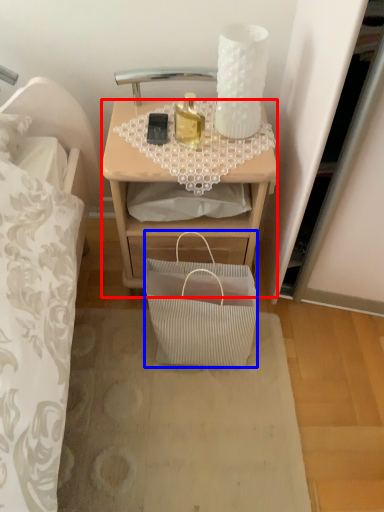
Question: Which object appears farthest to the camera in this image, desk (highlighted by a red box) or handbag (highlighted by a blue box)?

Choices:
 (A) desk
 (B) handbag

Answer: (A)